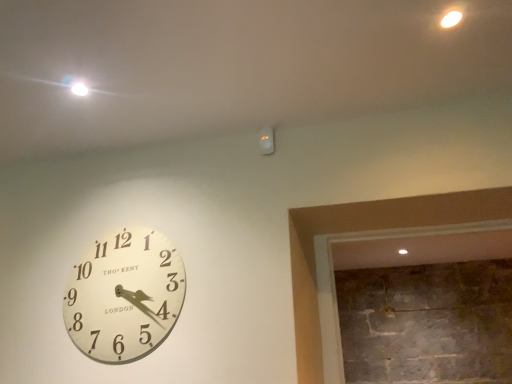
Question: Should I look upward or downward to see white wooden clock at left?

Choices:
 (A) down
 (B) up

Answer: (A)